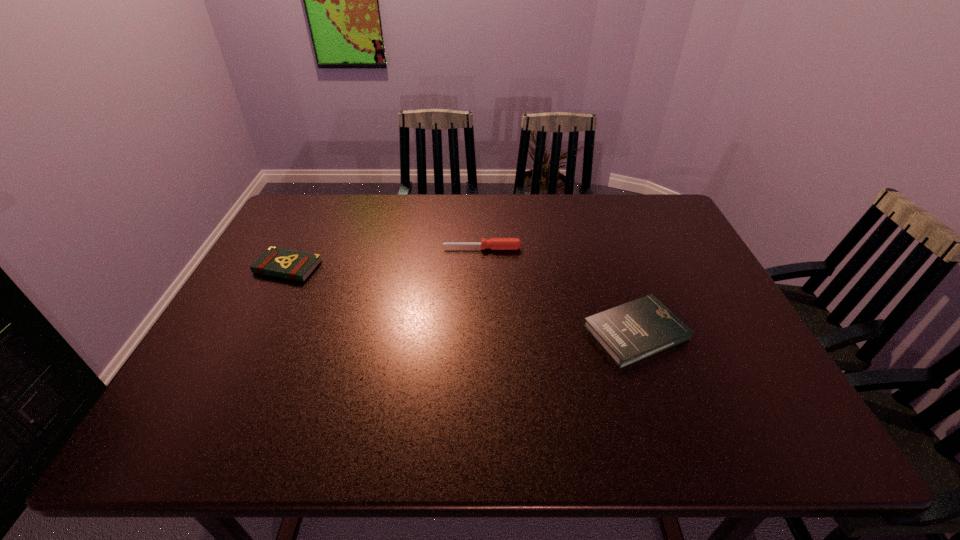
Find the location of `screwdriver`. screwdriver is located at coordinates click(494, 243).

The image size is (960, 540). I want to click on the second object from right to left, so click(494, 243).

Locate an element on the screen. Image resolution: width=960 pixels, height=540 pixels. the nearest object is located at coordinates (630, 332).

Where is `the nearer book`? the nearer book is located at coordinates click(630, 332).

Where is `the farther book`? This screenshot has width=960, height=540. the farther book is located at coordinates (295, 265).

I want to click on the second farthest object, so click(x=295, y=265).

Where is `vacant space located 0.120m on the right of the screwdriver`? vacant space located 0.120m on the right of the screwdriver is located at coordinates (562, 248).

Identify the location of free spot located on the back of the nearest object. [612, 267].

The width and height of the screenshot is (960, 540). Identify the location of free spot located 0.390m on the front of the farther book. (215, 409).

Identify the location of object that is positioned at the left edge. The height and width of the screenshot is (540, 960). (295, 265).